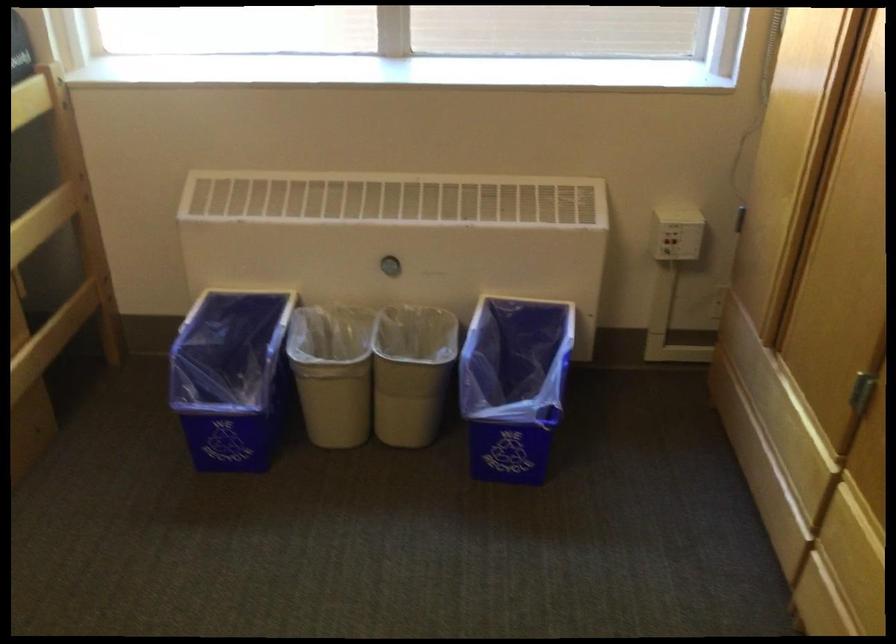
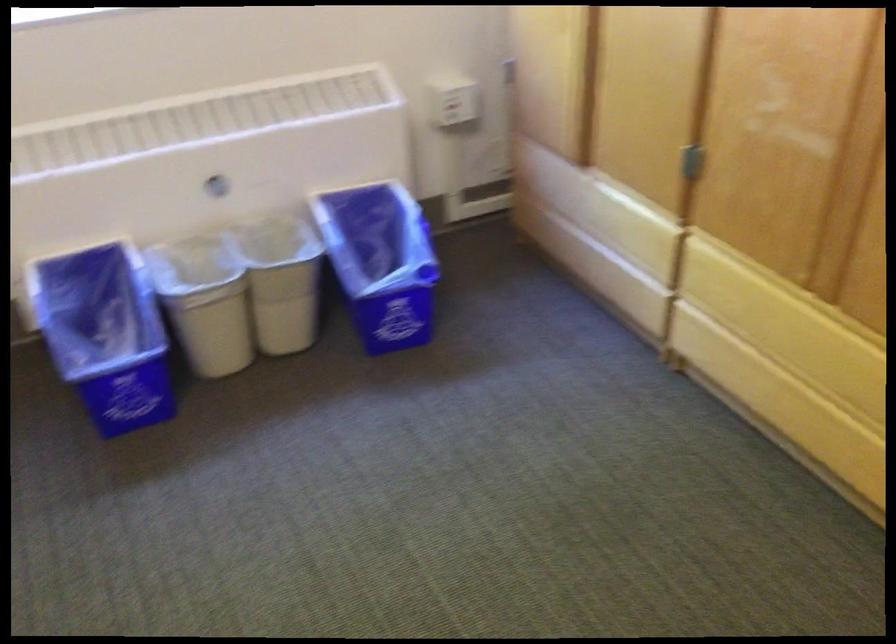
Question: What movement of the cameraman would produce the second image?

Choices:
 (A) Left
 (B) Right
 (C) Forward
 (D) Backward

Answer: (A)